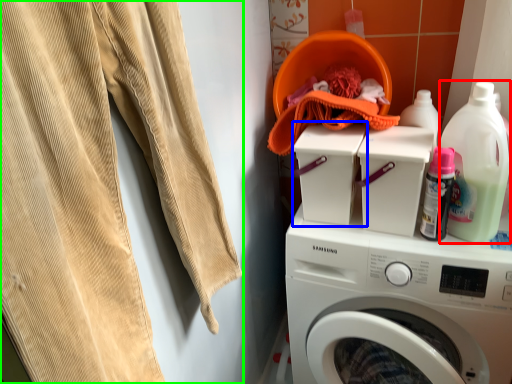
Question: Considering the real-world distances, which object is farthest from cleaning product (highlighted by a red box)? washing machine (highlighted by a blue box) or sweat pant (highlighted by a green box)?

Choices:
 (A) washing machine
 (B) sweat pant

Answer: (B)